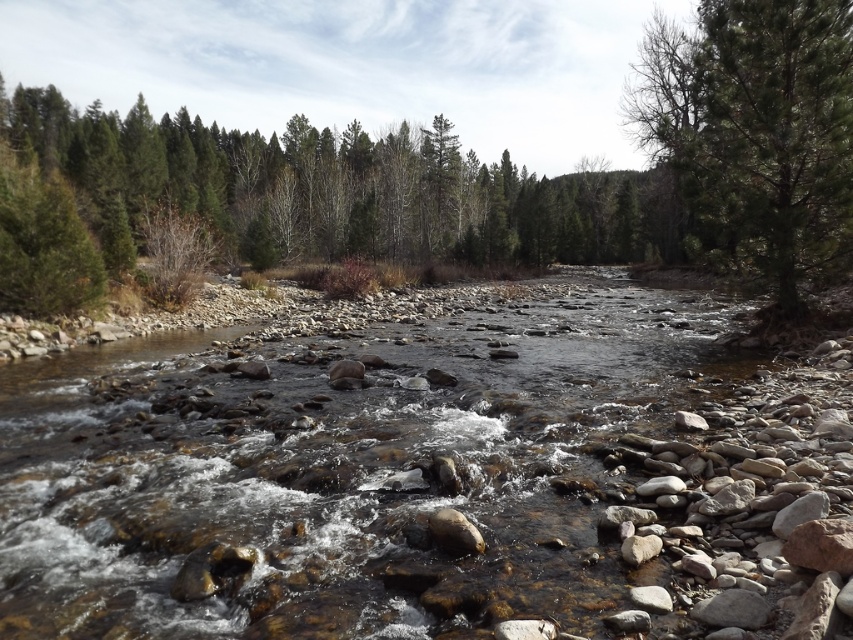
Question: From the image, what is the correct spatial relationship of smooth rock stream at center in relation to green textured tree at upper right?

Choices:
 (A) below
 (B) above

Answer: (A)

Question: Is smooth rock stream at center smaller than green textured tree at upper right?

Choices:
 (A) no
 (B) yes

Answer: (B)

Question: Which point appears farthest from the camera in this image?

Choices:
 (A) (737, 16)
 (B) (51, 372)

Answer: (A)

Question: Does smooth rock stream at center have a greater width compared to green textured tree at upper right?

Choices:
 (A) no
 (B) yes

Answer: (B)

Question: Among these objects, which one is farthest from the camera?

Choices:
 (A) green textured tree at upper right
 (B) smooth rock stream at center

Answer: (A)